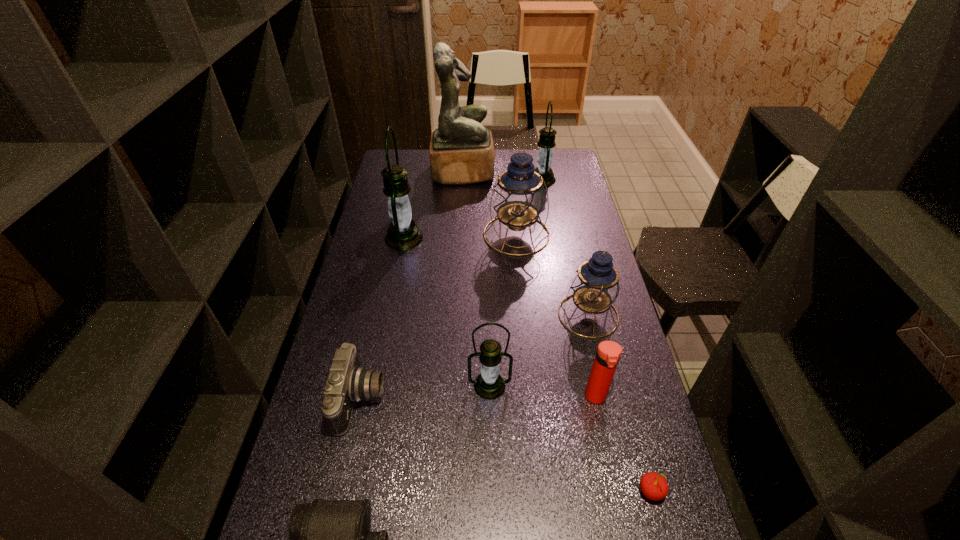
Where is `lantern that is at the left edge`? This screenshot has height=540, width=960. lantern that is at the left edge is located at coordinates (403, 234).

This screenshot has height=540, width=960. Find the location of `camera present at the left edge`. camera present at the left edge is located at coordinates (347, 383).

The image size is (960, 540). Identify the location of thermos bottle located in the right edge section of the desktop. (608, 353).

Locate an element on the screen. The image size is (960, 540). cherry at the right edge is located at coordinates (654, 486).

Image resolution: width=960 pixels, height=540 pixels. Identify the location of object present at the far right corner. (546, 142).

Where is `free location at the far edge of the desktop`? The image size is (960, 540). free location at the far edge of the desktop is located at coordinates (426, 166).

At what (x,y) coordinates should I click in order to perform the action: click on vacant space at the left edge of the desktop. Please return your answer as a coordinate pair (x, y). Looking at the image, I should click on (336, 331).

Locate an element on the screen. This screenshot has height=540, width=960. vacant space at the right edge of the desktop is located at coordinates (623, 324).

Identify the location of free spot between the bigger blue lantern and the second green lantern from right to left. The width and height of the screenshot is (960, 540). (503, 310).

Find the location of a particular element. Image resolution: width=960 pixels, height=540 pixels. free point between the farthest lantern and the cherry is located at coordinates (597, 335).